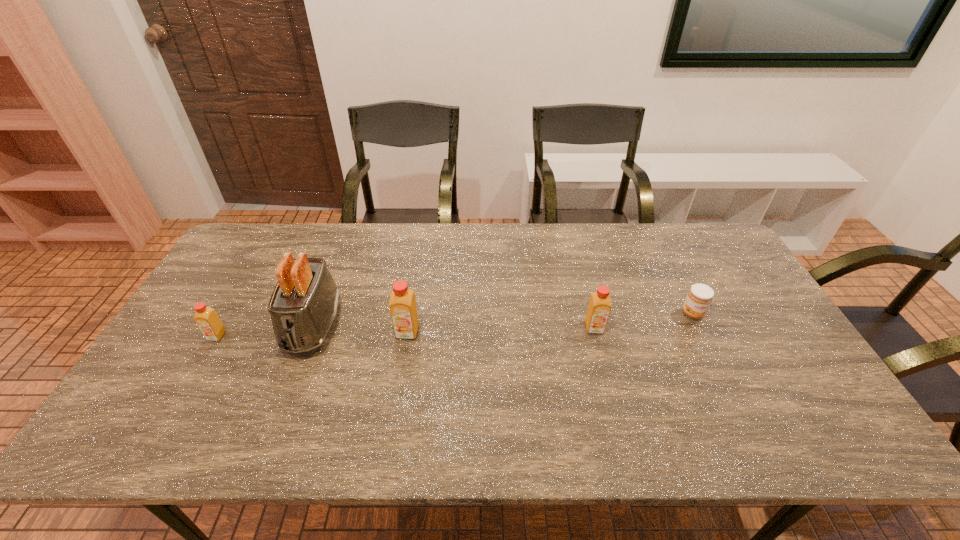
Locate which object ranks second in proximity to the rightmost object. Please provide its 2D coordinates. Your answer should be formatted as a tuple, i.e. [(x, y)], where the tuple contains the x and y coordinates of a point satisfying the conditions above.

[(403, 310)]

Locate which orange juice ranks second in proximity to the fourth object from left to right. Please provide its 2D coordinates. Your answer should be formatted as a tuple, i.e. [(x, y)], where the tuple contains the x and y coordinates of a point satisfying the conditions above.

[(206, 318)]

Image resolution: width=960 pixels, height=540 pixels. What are the coordinates of `the closest orange juice relative to the fourth object from right to left` in the screenshot? It's located at click(206, 318).